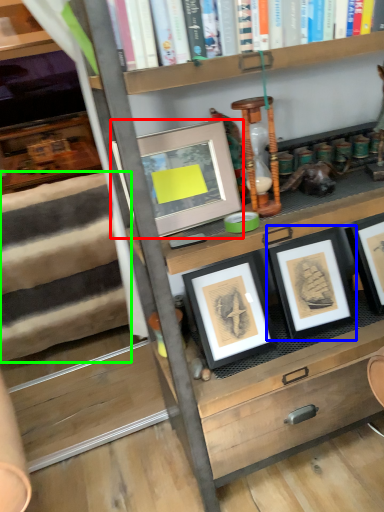
Question: Estimate the real-world distances between objects in this image. Which object is closer to picture frame (highlighted by a red box), picture frame (highlighted by a blue box) or stair (highlighted by a green box)?

Choices:
 (A) picture frame
 (B) stair

Answer: (A)